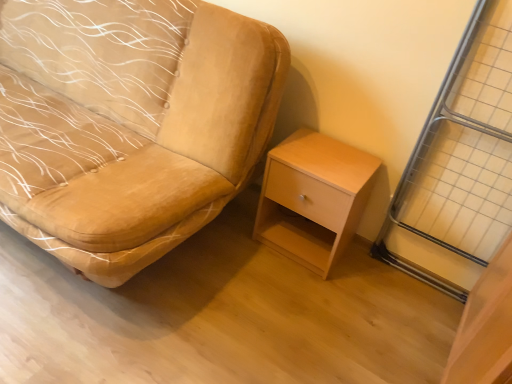
What are the coordinates of `free space in front of metallic silver screen door at right` in the screenshot? It's located at (414, 319).